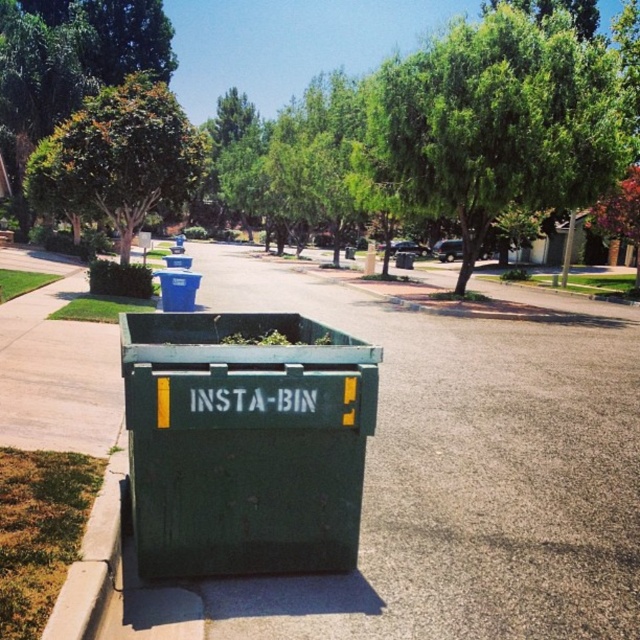
You are a waste management worker who needs to determine which recycling bin can accommodate taller items. Based on the scene, which bin between the green matte recycling bin at center and the blue plastic recycling bin at upper left should you choose?

The green matte recycling bin at center is much taller than the blue plastic recycling bin at upper left, so you should choose the green matte recycling bin at center to accommodate taller items.

You are standing on the sidewalk and see the green matte recycling bin at center and the green leafy tree at upper center. Which object is closer to the ground?

The green matte recycling bin at center is closer to the ground because it is below the green leafy tree at upper center.

You are a delivery person trying to navigate through the suburban street scene. You need to place a new recycling bin between the green matte recycling bin at center and the blue plastic recycling bin at upper left. Based on their positions, which bin should you place the new bin next to to keep it aligned with the existing arrangement?

The green matte recycling bin at center is positioned on the right side of the blue plastic recycling bin at upper left. To maintain alignment with the existing arrangement, the new recycling bin should be placed next to the blue plastic recycling bin at upper left, ensuring it stays to the left of the green matte recycling bin at center.